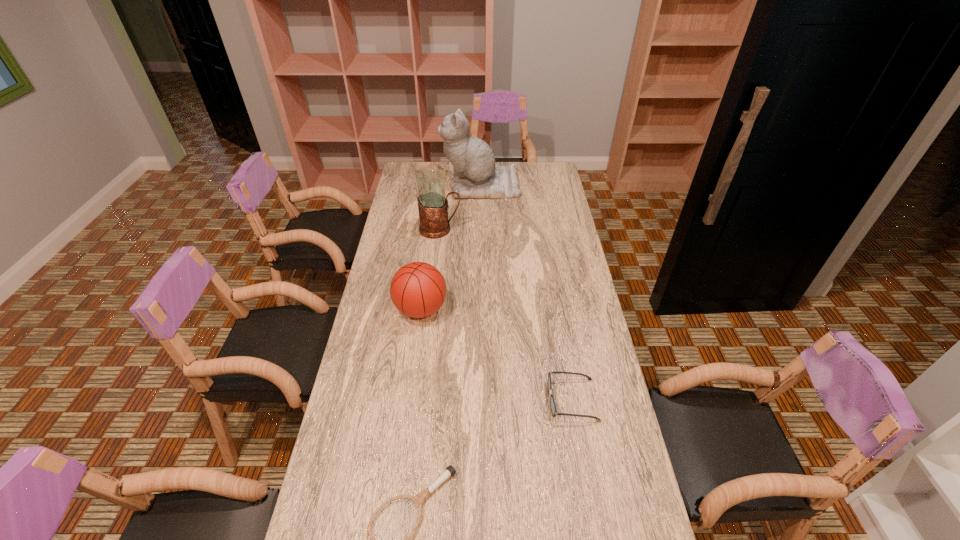
The image size is (960, 540). In the image, there is a desktop. What are the coordinates of `blank space at the far edge` in the screenshot? It's located at (523, 164).

Identify the location of vacant space at the left edge of the desktop. (393, 363).

This screenshot has height=540, width=960. In order to click on vacant space at the right edge of the desktop in this screenshot , I will do `click(625, 491)`.

In the image, there is a desktop. Identify the location of vacant space at the far right corner. The width and height of the screenshot is (960, 540). (553, 171).

I want to click on vacant space that's between the tallest object and the second shortest object, so click(526, 293).

Where is `vacant space that's between the basketball and the spectacles`? The image size is (960, 540). vacant space that's between the basketball and the spectacles is located at coordinates (496, 355).

Where is `blank region between the basketball and the cat`? blank region between the basketball and the cat is located at coordinates (451, 247).

Where is `free spot between the tallest object and the pitcher`? Image resolution: width=960 pixels, height=540 pixels. free spot between the tallest object and the pitcher is located at coordinates (461, 207).

Identify which object is located as the nearest to the cat. Please provide its 2D coordinates. Your answer should be formatted as a tuple, i.e. [(x, y)], where the tuple contains the x and y coordinates of a point satisfying the conditions above.

[(432, 201)]

Image resolution: width=960 pixels, height=540 pixels. Find the location of `object that can be found as the third closest to the pitcher`. object that can be found as the third closest to the pitcher is located at coordinates (552, 402).